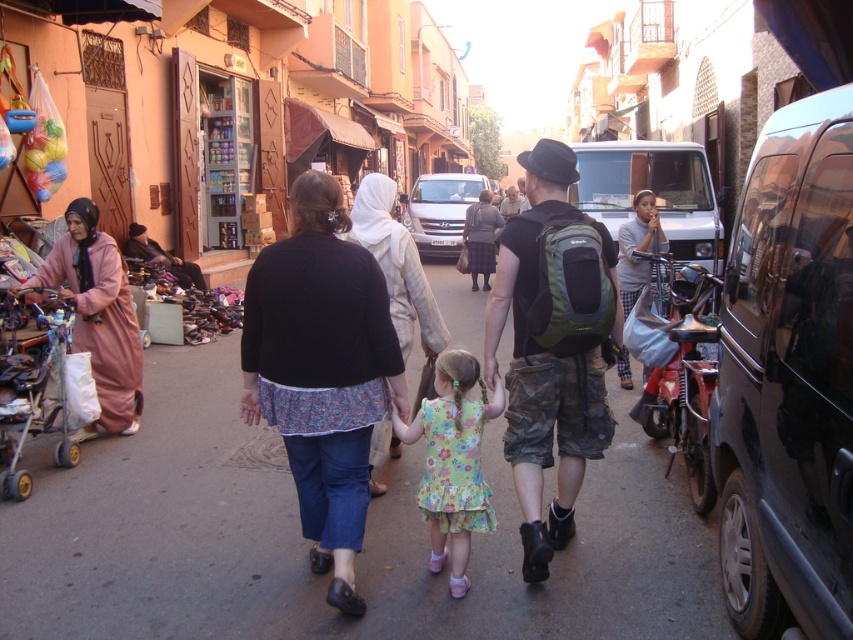
You are a delivery person trying to park your black matte van at right in a spot next to the pink fabric dress at left. Given that the parking space is only large enough for one vehicle, can your van fit without overlapping the dress?

The black matte van at right is bigger than the pink fabric dress at left. However, the parking space is only for one vehicle, so the van may not fit properly and could overlap the dress if it tries to park there.

You are a delivery person who needs to place a package on the ground near the black cotton shirt at center. According to the image, where should you place the package in terms of coordinates?

The package should be placed near the coordinates corresponding to the black cotton shirt at center, which is located at point (321,371).